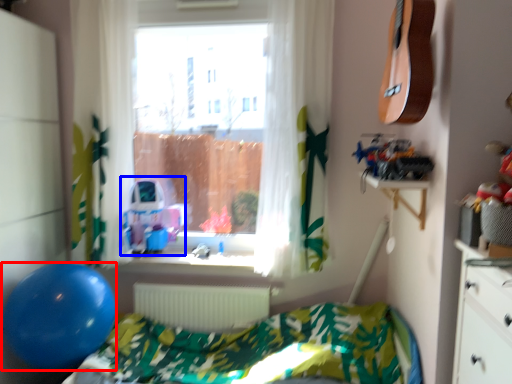
Question: Which object is further to the camera taking this photo, balloon (highlighted by a red box) or toy (highlighted by a blue box)?

Choices:
 (A) balloon
 (B) toy

Answer: (B)